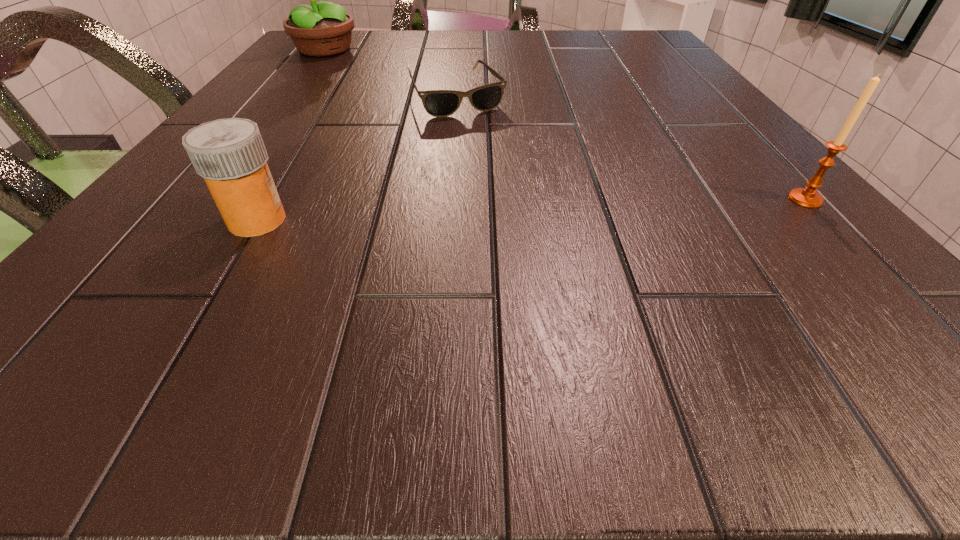
Identify the location of vacant space on the desktop that is between the medicine and the rightmost object and is positioned on the lenses of the second farthest object. The width and height of the screenshot is (960, 540). (538, 210).

Image resolution: width=960 pixels, height=540 pixels. What are the coordinates of `free space on the desktop that is between the second shortest object and the rightmost object and is positioned on the face of the tallest object` in the screenshot? It's located at (588, 208).